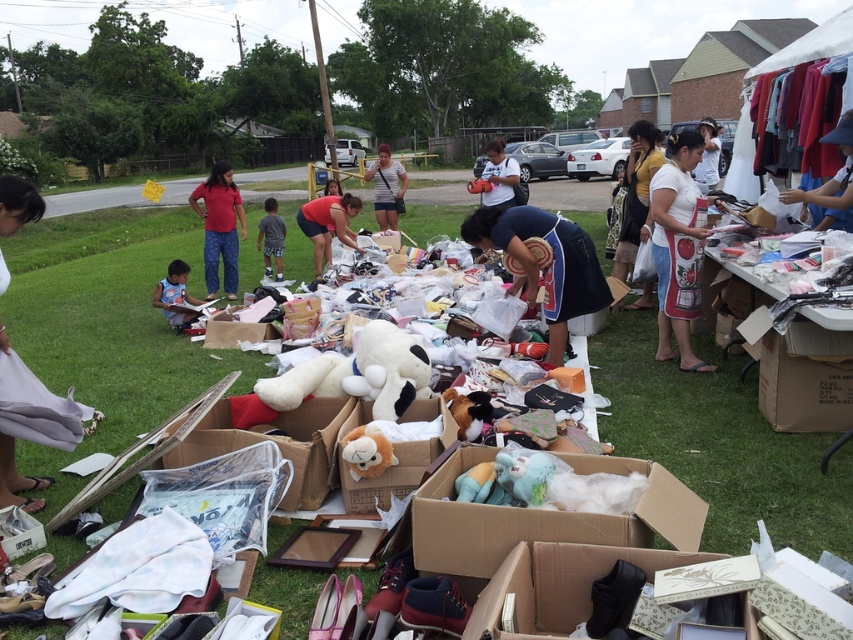
Does white plush toy at center have a smaller size compared to gray cotton shorts at center?

Correct, white plush toy at center occupies less space than gray cotton shorts at center.

Is point (299, 458) positioned in front of point (277, 250)?

That is True.

Between point (315, 502) and point (273, 241), which one is positioned in front?

Point (315, 502) is in front.

I want to click on white plush toy at center, so click(277, 444).

Does fluffy plush toy at center appear on the right side of light blue fabric shirt at lower left?

Correct, you'll find fluffy plush toy at center to the right of light blue fabric shirt at lower left.

Which is more to the right, fluffy plush toy at center or light blue fabric shirt at lower left?

From the viewer's perspective, fluffy plush toy at center appears more on the right side.

Measure the distance between point (409, 444) and camera.

3.28 meters

You are a GUI agent. You are given a task and a screenshot of the screen. Output one action in this format:
    pyautogui.click(x=<x>, y=<y>)
    Task: Click on the fluffy plush toy at center
    
    Given the screenshot: What is the action you would take?
    pyautogui.click(x=395, y=456)

Is brown plush toy at center positioned before light blue fabric shirt at lower left?

Yes, brown plush toy at center is in front of light blue fabric shirt at lower left.

From the picture: Does brown plush toy at center have a lesser height compared to light blue fabric shirt at lower left?

Indeed, brown plush toy at center has a lesser height compared to light blue fabric shirt at lower left.

This screenshot has width=853, height=640. What are the coordinates of `brown plush toy at center` in the screenshot? It's located at (367, 451).

Where is `brown plush toy at center`? This screenshot has height=640, width=853. brown plush toy at center is located at coordinates 367,451.